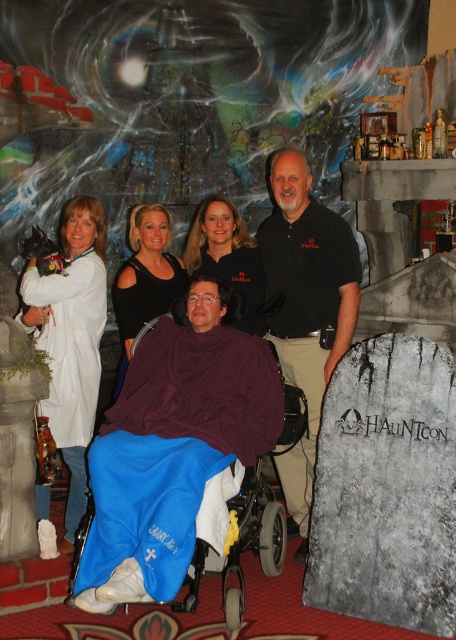
Between black matte dress at center and smooth black shirt at center, which one has more height?

With more height is black matte dress at center.

Can you confirm if black matte dress at center is positioned to the left of smooth black shirt at center?

Yes, black matte dress at center is to the left of smooth black shirt at center.

At what (x,y) coordinates should I click in order to perform the action: click on black matte dress at center. Please return your answer as a coordinate pair (x, y). The width and height of the screenshot is (456, 640). Looking at the image, I should click on (145, 276).

Which of these two, black cotton shirt at center or black matte dress at center, stands taller?

black cotton shirt at center is taller.

Who is more distant from viewer, (x=299, y=552) or (x=136, y=326)?

Positioned behind is point (x=136, y=326).

The width and height of the screenshot is (456, 640). What do you see at coordinates (306, 308) in the screenshot? I see `black cotton shirt at center` at bounding box center [306, 308].

This screenshot has width=456, height=640. Find the location of `black cotton shirt at center`. black cotton shirt at center is located at coordinates (306, 308).

Is point (196, 410) less distant than point (165, 273)?

Yes, point (196, 410) is in front of point (165, 273).

Who is shorter, maroon fleece wheelchair at center or black matte dress at center?

maroon fleece wheelchair at center

Which is in front, point (236, 429) or point (146, 227)?

Positioned in front is point (236, 429).

This screenshot has height=640, width=456. I want to click on maroon fleece wheelchair at center, so click(202, 388).